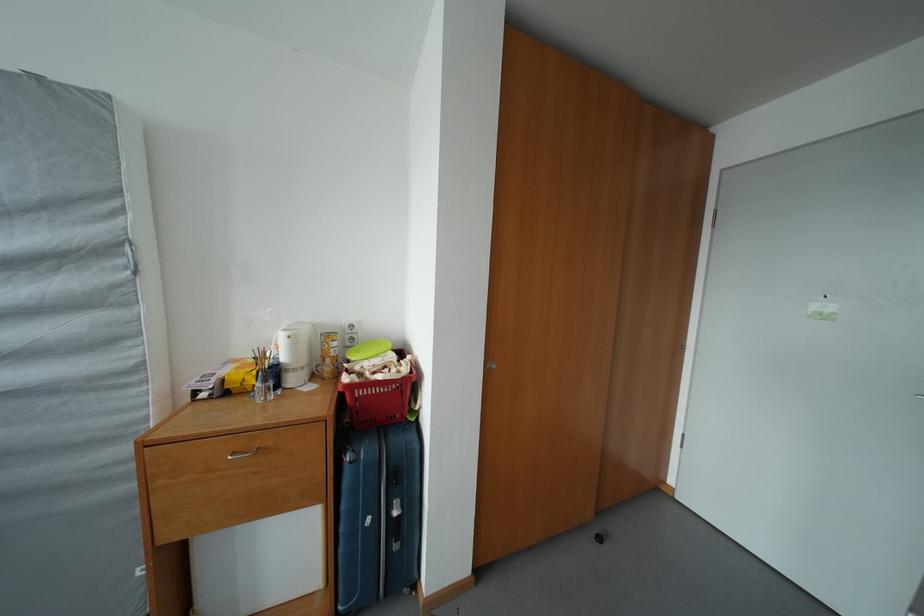
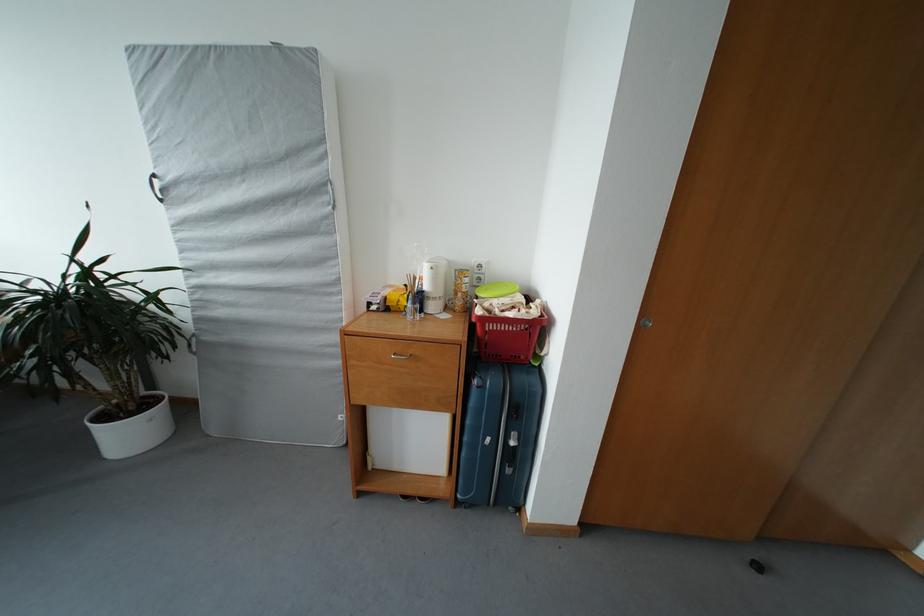
Question: The first image is from the beginning of the video and the second image is from the end. How did the camera likely rotate when shooting the video?

Choices:
 (A) Left
 (B) Right
 (C) Up
 (D) Down

Answer: (A)